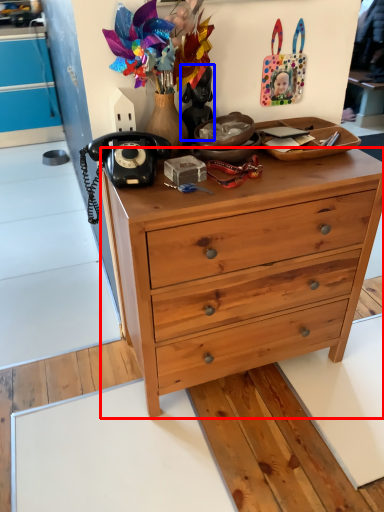
Question: Which object appears farthest to the camera in this image, desk (highlighted by a red box) or person (highlighted by a blue box)?

Choices:
 (A) desk
 (B) person

Answer: (B)